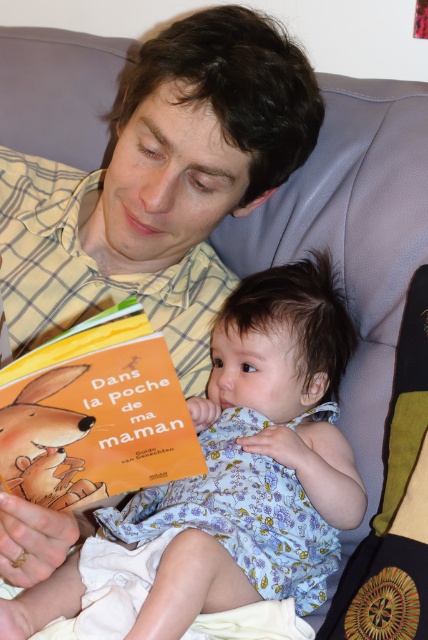
Question: Is light blue fabric dress at center below orange matte book at center?

Choices:
 (A) yes
 (B) no

Answer: (A)

Question: Which point is closer to the camera?

Choices:
 (A) (279, 321)
 (B) (12, 477)

Answer: (B)

Question: Does light blue fabric dress at center have a lesser width compared to orange matte book at center?

Choices:
 (A) no
 (B) yes

Answer: (A)

Question: Which object appears closest to the camera in this image?

Choices:
 (A) light blue fabric dress at center
 (B) orange matte book at center

Answer: (B)

Question: Does light blue fabric dress at center appear on the right side of orange matte book at center?

Choices:
 (A) yes
 (B) no

Answer: (A)

Question: Which point appears farthest from the camera in this image?

Choices:
 (A) (11, 452)
 (B) (222, 317)

Answer: (B)